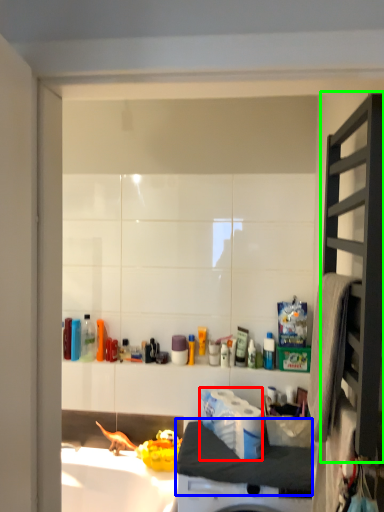
Question: Which object is the farthest from toilet paper (highlighted by a red box)? Choose among these: counter top (highlighted by a blue box) or shelf (highlighted by a green box).

Choices:
 (A) counter top
 (B) shelf

Answer: (B)